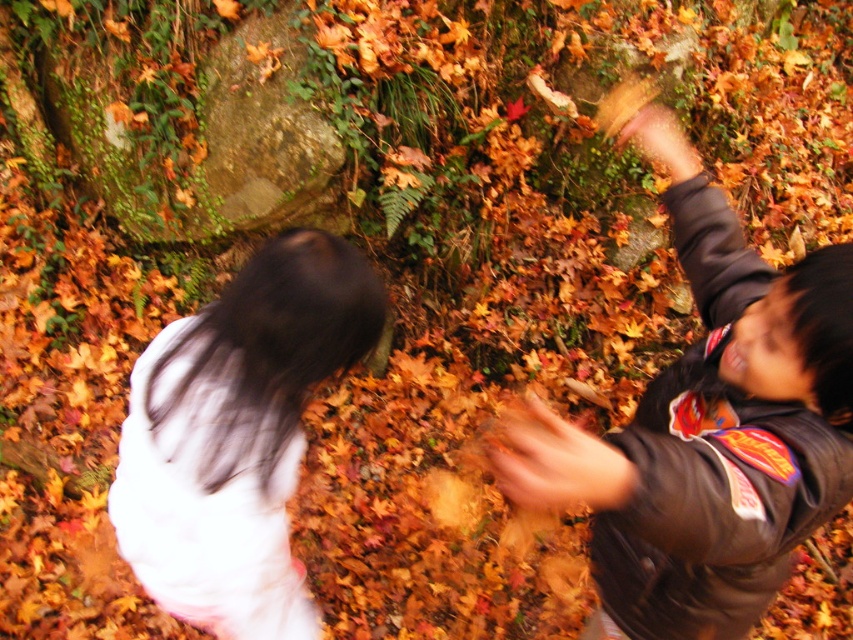
You are an observer looking at the scene. You notice the dark gray jacket at right and the white matte shirt at upper left. Which object is positioned higher in the image?

The dark gray jacket at right is above the white matte shirt at upper left, so the dark gray jacket at right is positioned higher in the image.

You are a photographer trying to capture a candid shot of the two people in the scene. The white matte shirt at upper left and the blurred brown hand at center are both in your viewfinder. Based on their positions, which object is closer to the camera?

The white matte shirt at upper left is located above the blurred brown hand at center, which means it is closer to the camera.